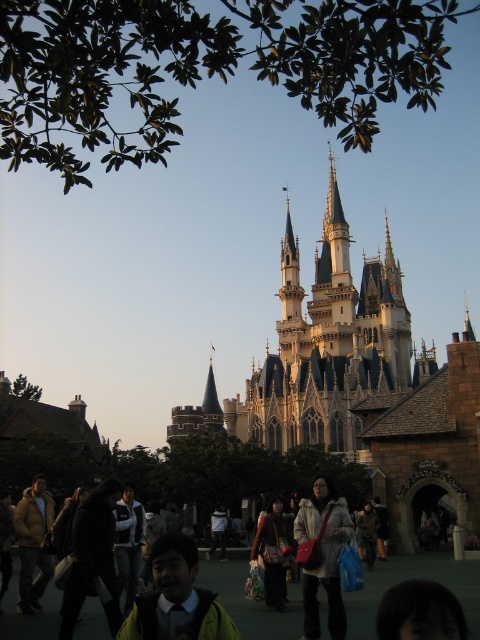
Question: Observing the image, what is the correct spatial positioning of matte gray coat at center in reference to matte black jacket at center?

Choices:
 (A) above
 (B) below

Answer: (A)

Question: Can you confirm if white stone castle at center is smaller than matte black jacket at center?

Choices:
 (A) yes
 (B) no

Answer: (B)

Question: Which object is the closest to the matte black jacket at center?

Choices:
 (A) green matte jacket at lower center
 (B) matte gray coat at center
 (C) white stone castle at center

Answer: (B)

Question: Observing the image, what is the correct spatial positioning of white stone castle at center in reference to green matte jacket at lower center?

Choices:
 (A) left
 (B) right

Answer: (B)

Question: Estimate the real-world distances between objects in this image. Which object is closer to the matte gray coat at center?

Choices:
 (A) green matte jacket at lower center
 (B) white stone castle at center

Answer: (A)

Question: Among these objects, which one is farthest from the camera?

Choices:
 (A) white stone castle at center
 (B) matte black jacket at center
 (C) matte gray coat at center
 (D) green matte jacket at lower center

Answer: (A)